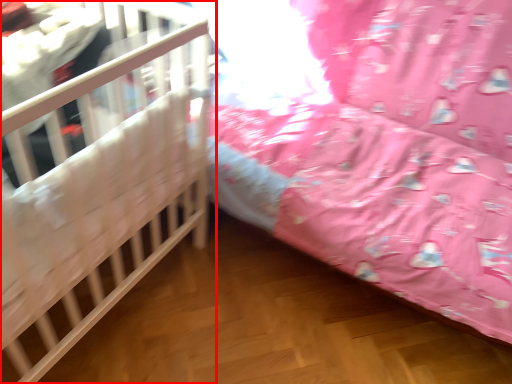
Question: From the image's perspective, considering the relative positions of infant bed (annotated by the red box) and infant bed in the image provided, where is infant bed (annotated by the red box) located with respect to the staircase?

Choices:
 (A) below
 (B) above

Answer: (A)